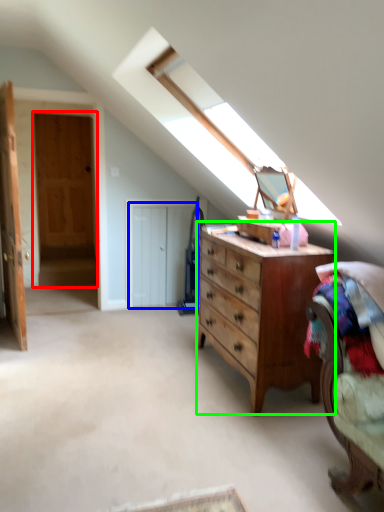
Question: Based on their relative distances, which object is nearer to door (highlighted by a red box)? Choose from door (highlighted by a blue box) and chest of drawers (highlighted by a green box).

Choices:
 (A) door
 (B) chest of drawers

Answer: (A)